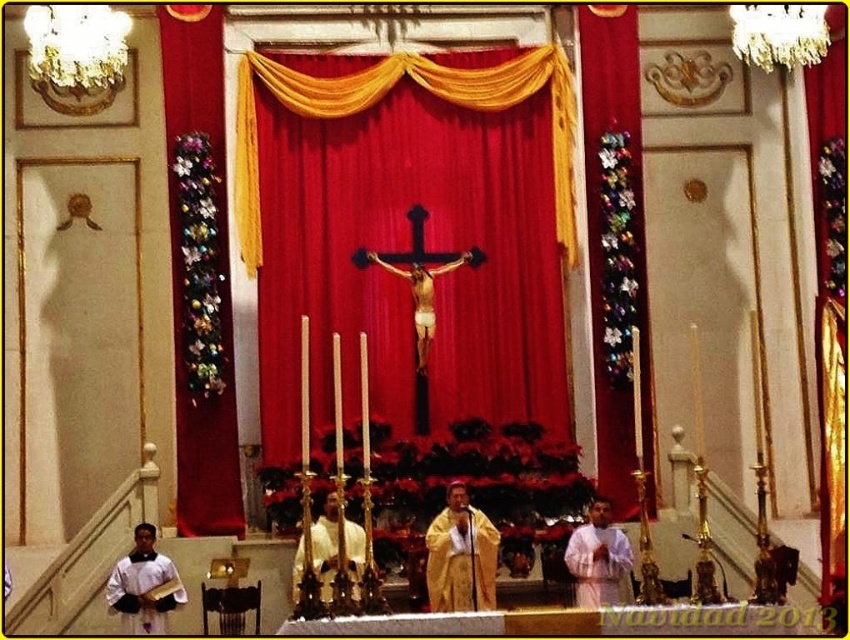
You are standing at the entrance of the church and notice a point marked at coordinates [616,248]. What object does this point correspond to in the scene?

The point corresponds to the multicolored fabric at right.

You are an attendee at this religious ceremony and need to determine the hierarchy of the individuals based on their attire. Which individual is of higher rank, the one wearing the golden silk robe at center or the white matte robe at lower left?

The golden silk robe at center is taller than the white matte robe at lower left, indicating that the individual wearing the golden silk robe at center holds a higher rank.

You are standing at the entrance of the church and want to locate the red velvet curtain at center. According to the coordinates provided, in which direction should you look to find it?

The red velvet curtain at center is located at coordinates point [383,96], so you should look to the left side of the church since the x coordinate is less than 0.5.